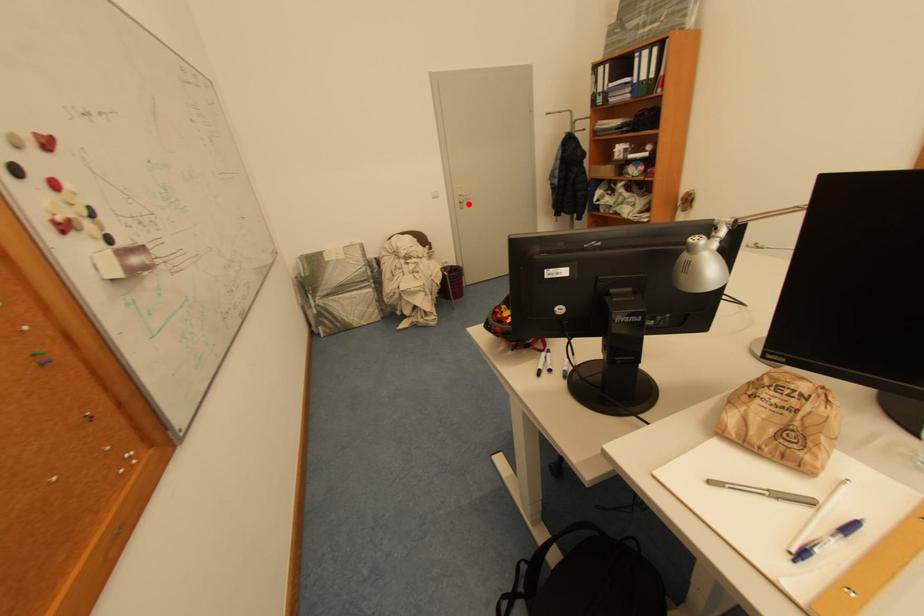
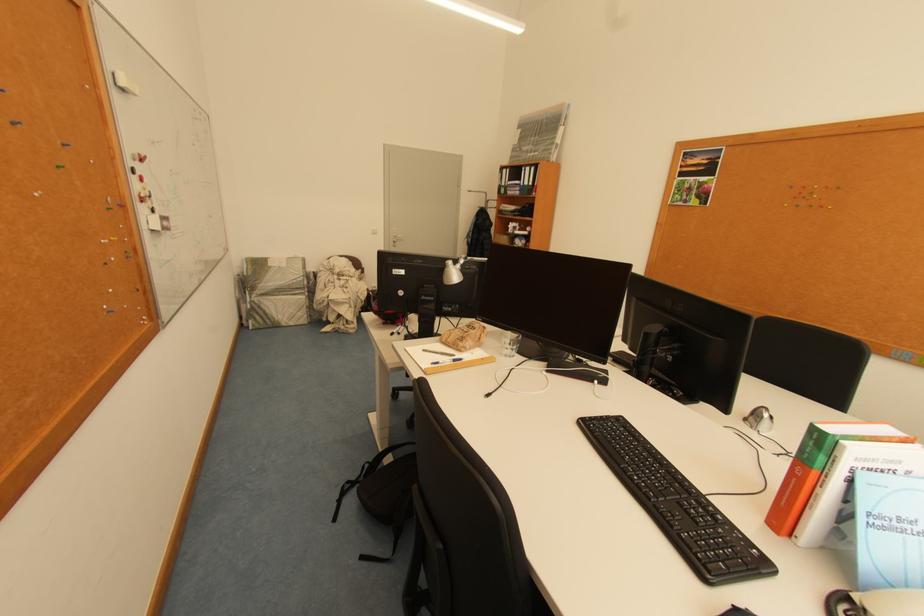
In the second image, find the point that corresponds to the highlighted location in the first image.

(402, 243)